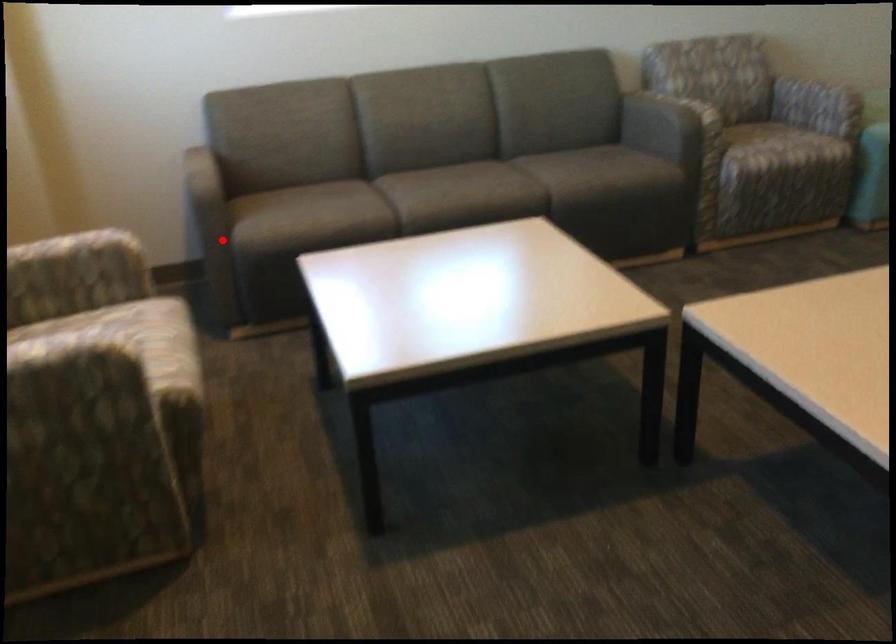
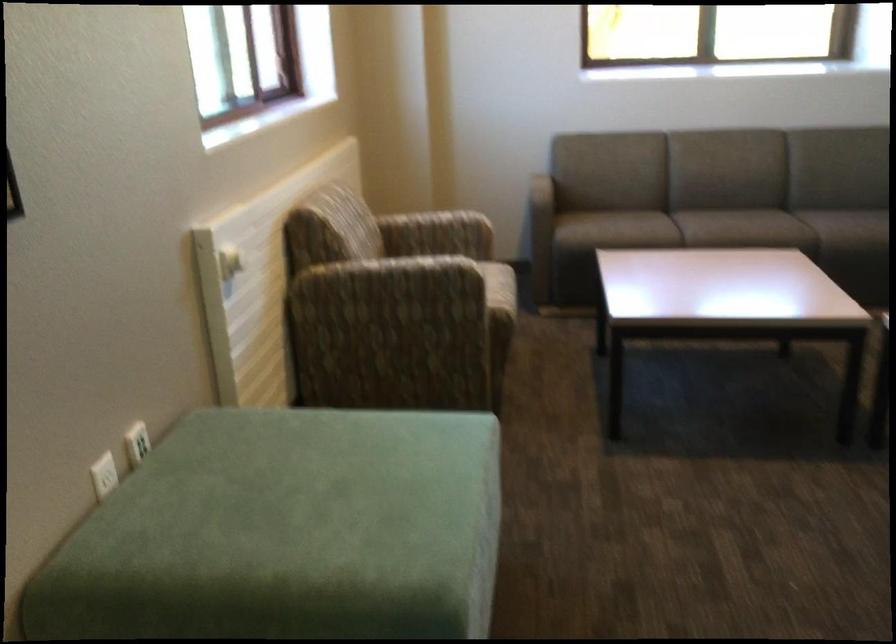
Where in the second image is the point corresponding to the highlighted location from the first image?

(540, 234)